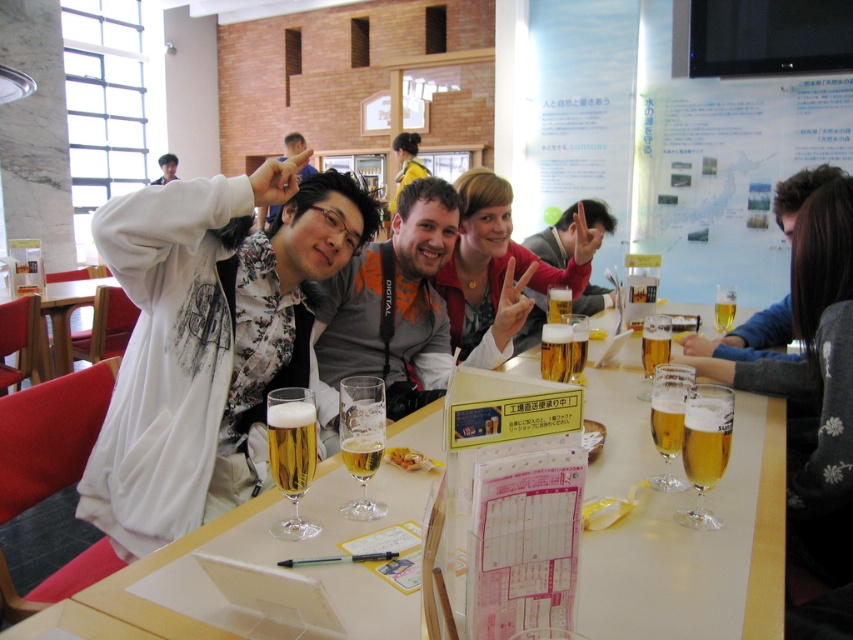
You are a photographer standing at the edge of the scene. You need to capture a closeup shot of the matte gray jacket at center without moving any objects. Since the jacket is on the wooden table at center, can you adjust your position to get the shot within 2 meters from the table?

The distance between the matte gray jacket at center and the wooden table at center is 1.92 meters. Since 1.92 meters is less than 2 meters, you can adjust your position to get the closeup shot within the 2 meter limit.

You are trying to place a small notebook on the table without covering any of the glasses or the calendar. Given the current arrangement, is there enough space on the wooden table at center for the matte gray jacket at center?

The matte gray jacket at center has a smaller size compared to wooden table at center, so there is enough space on the wooden table at center to place the small notebook without covering the glasses or calendar.

You are a photographer standing 2 meters away from the matte gray jacket at center. Can you take a clear photo of it without moving closer?

The distance between you and the matte gray jacket at center is 1.95 meters, which is just under 2 meters. Since you are already within that range, you can take a clear photo without needing to move closer.